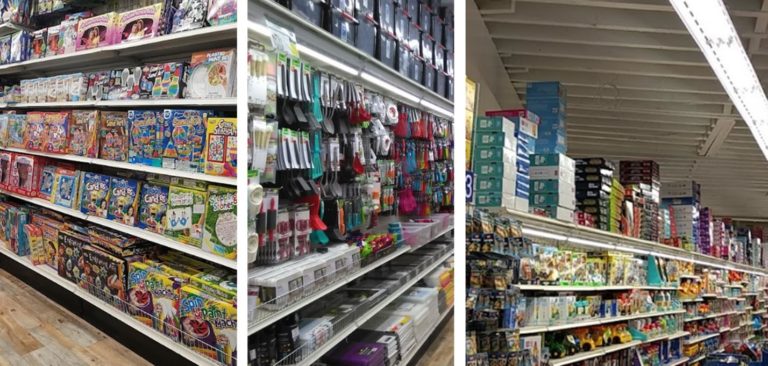
You are a GUI agent. You are given a task and a screenshot of the screen. Output one action in this format:
    pyautogui.click(x=<x>, y=<y>)
    Task: Click on the toys
    
    Given the screenshot: What is the action you would take?
    [141, 75], [133, 137], [121, 200], [113, 275]